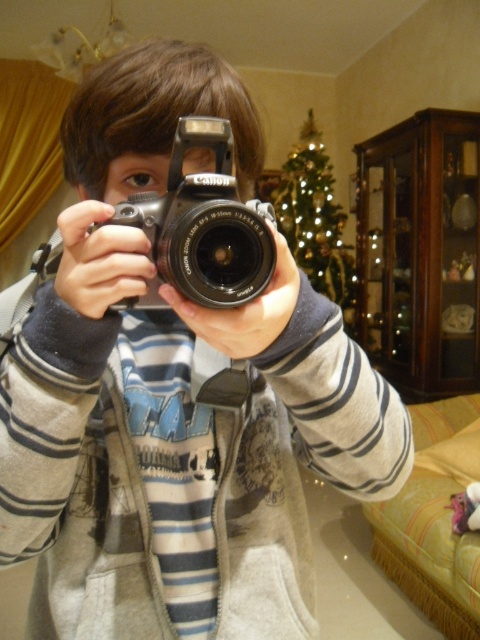
You are setting up a holiday photo shoot and need to position the black plastic camera at center and the green textured christmas tree at upper center in the frame. According to the scene description, where should you place the black plastic camera relative to the green textured christmas tree?

The black plastic camera at center should be placed below the green textured christmas tree at upper center as per the scene description.

You are setting up a holiday photo shoot and need to position the black plastic camera at center and the green textured christmas tree at upper center in the frame. Based on their sizes, which object should you place closer to the camera to ensure both fill the frame appropriately?

The black plastic camera at center is not as tall as the green textured christmas tree at upper center, so to ensure both fill the frame appropriately, you should place the black plastic camera at center closer to the camera since it is smaller and the green textured christmas tree at upper center further back to balance their sizes in the composition.